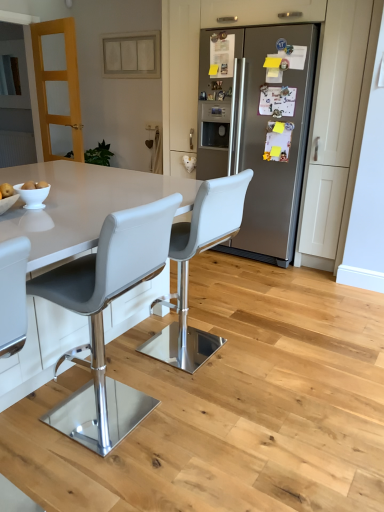
Where is `vacant space that's between white leather stool at center, which is the 2th chair in front-to-back order, and white leather stool at center, arranged as the first chair when viewed from the front`? This screenshot has width=384, height=512. vacant space that's between white leather stool at center, which is the 2th chair in front-to-back order, and white leather stool at center, arranged as the first chair when viewed from the front is located at coordinates (165, 381).